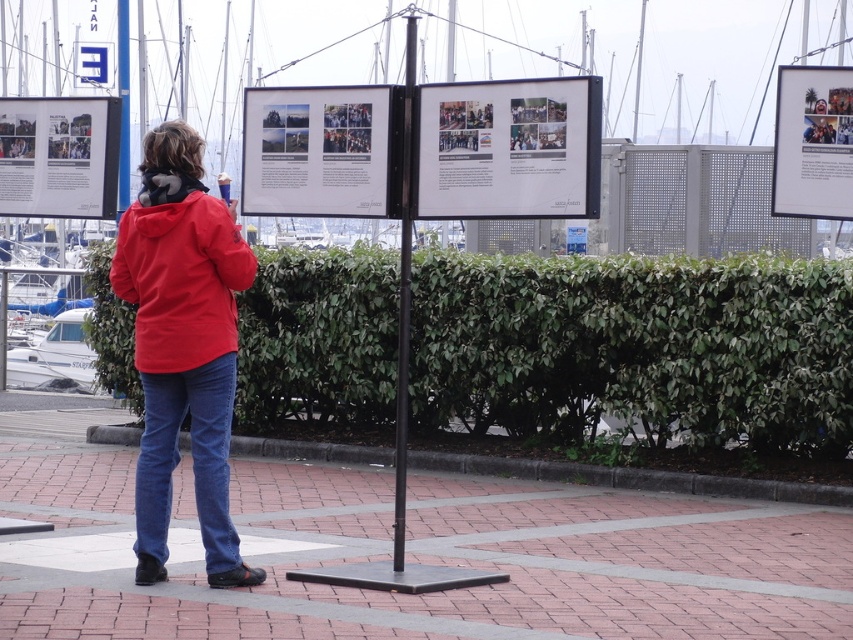
You are a photographer trying to capture the best angle of the scene. You notice two points in the image at coordinates point (x=143, y=209) and point (x=21, y=380). Which point should you focus on to ensure it appears larger in your photo?

Point (x=143, y=209) is closer to the camera than point (x=21, y=380), so focusing on point (x=143, y=209) will make it appear larger in the photo.